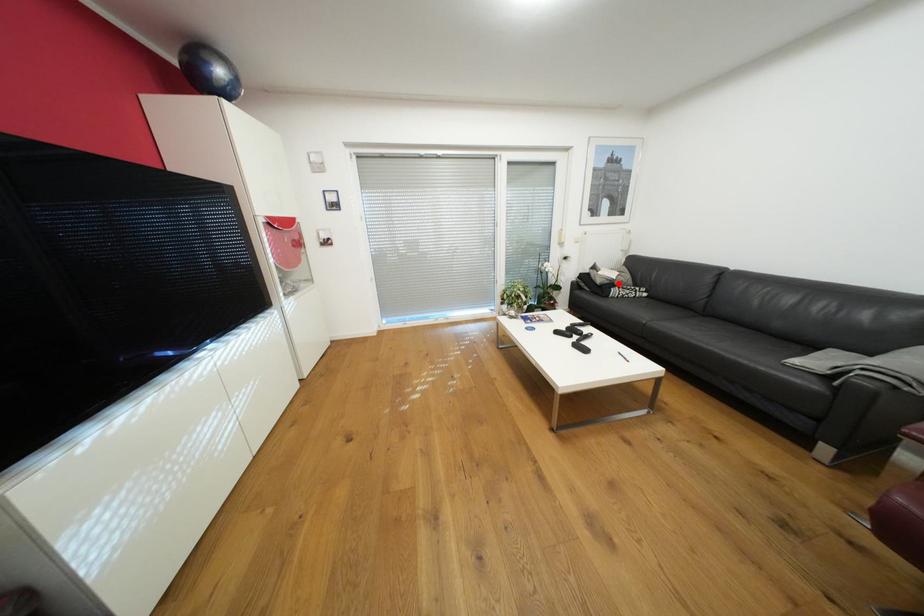
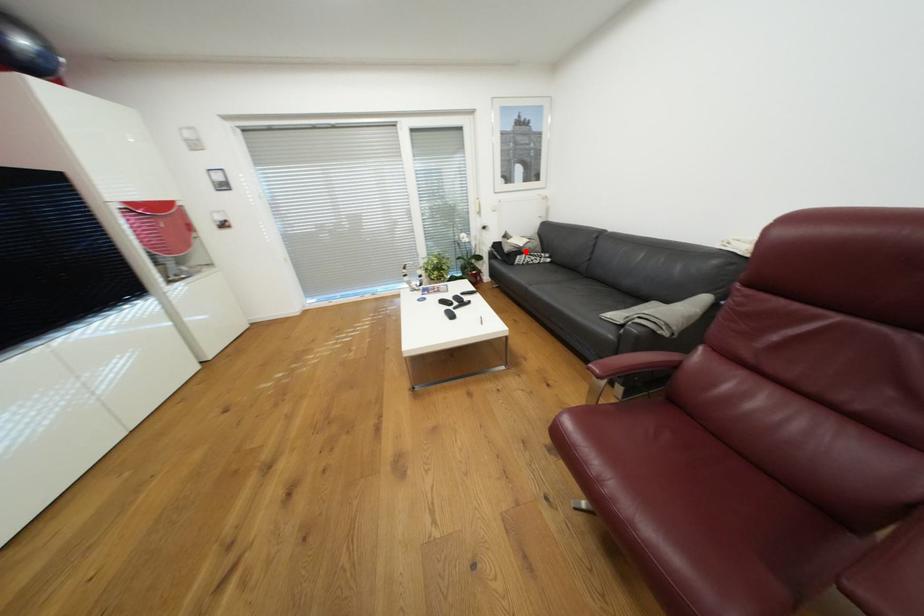
Consider the image. I am providing you with two images of the same scene from different viewpoints. A red point is marked on the first image and another point is marked on the second image. Are the points marked in image1 and image2 representing the same 3D position?

Yes